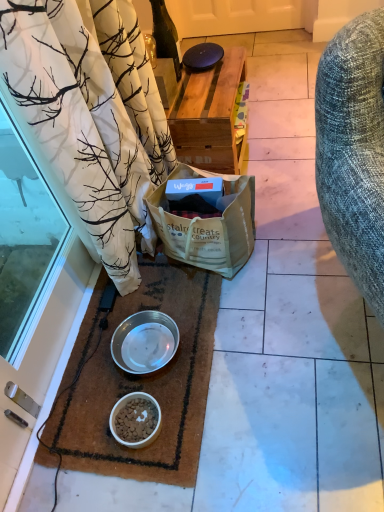
Question: From a real-world perspective, is white matte bowl at lower center, which is the 2th bowl from top to bottom, located beneath brown woven mat at lower left?

Choices:
 (A) yes
 (B) no

Answer: (B)

Question: From the image's perspective, is white matte bowl at lower center, which is the 2th bowl from top to bottom, on brown woven mat at lower left?

Choices:
 (A) yes
 (B) no

Answer: (B)

Question: Could brown woven mat at lower left be considered to be inside white matte bowl at lower center, placed as the first bowl when sorted from bottom to top?

Choices:
 (A) yes
 (B) no

Answer: (B)

Question: Is white matte bowl at lower center, placed as the first bowl when sorted from bottom to top, oriented towards brown woven mat at lower left?

Choices:
 (A) no
 (B) yes

Answer: (A)

Question: Considering the relative sizes of white matte bowl at lower center, placed as the first bowl when sorted from bottom to top, and brown woven mat at lower left in the image provided, is white matte bowl at lower center, placed as the first bowl when sorted from bottom to top, thinner than brown woven mat at lower left?

Choices:
 (A) yes
 (B) no

Answer: (A)

Question: Can you confirm if white matte bowl at lower center, placed as the first bowl when sorted from bottom to top, is positioned to the right of brown woven mat at lower left?

Choices:
 (A) yes
 (B) no

Answer: (A)

Question: Considering the relative positions of white matte bowl at lower center, placed as the first bowl when sorted from bottom to top, and transparent glass door at lower left in the image provided, is white matte bowl at lower center, placed as the first bowl when sorted from bottom to top, behind transparent glass door at lower left?

Choices:
 (A) yes
 (B) no

Answer: (A)

Question: From the image's perspective, does white matte bowl at lower center, placed as the first bowl when sorted from bottom to top, appear higher than transparent glass door at lower left?

Choices:
 (A) yes
 (B) no

Answer: (B)

Question: Can you confirm if white matte bowl at lower center, placed as the first bowl when sorted from bottom to top, is positioned to the left of transparent glass door at lower left?

Choices:
 (A) yes
 (B) no

Answer: (B)

Question: Does white matte bowl at lower center, placed as the first bowl when sorted from bottom to top, have a greater width compared to transparent glass door at lower left?

Choices:
 (A) yes
 (B) no

Answer: (A)

Question: Is transparent glass door at lower left at the back of white matte bowl at lower center, placed as the first bowl when sorted from bottom to top?

Choices:
 (A) no
 (B) yes

Answer: (B)

Question: From a real-world perspective, is white matte bowl at lower center, which is the 2th bowl from top to bottom, on transparent glass door at lower left?

Choices:
 (A) yes
 (B) no

Answer: (B)

Question: Can you confirm if black glossy tile at center is wider than white matte bowl at lower center, placed as the first bowl when sorted from bottom to top?

Choices:
 (A) yes
 (B) no

Answer: (A)